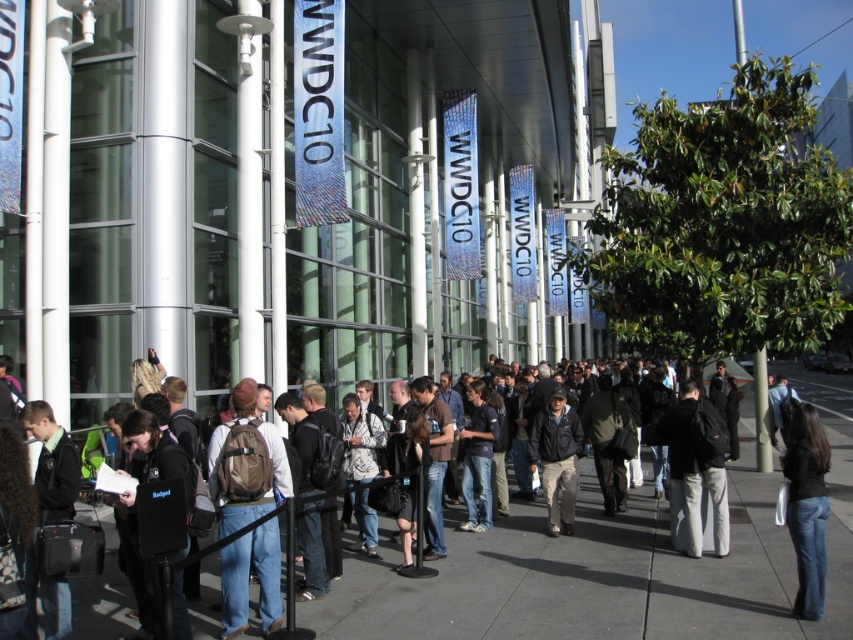
Question: Among these points, which one is farthest from the camera?

Choices:
 (A) (697, 406)
 (B) (241, 572)
 (C) (805, 496)
 (D) (567, 531)

Answer: (D)

Question: From the image, what is the correct spatial relationship of brown backpack at center in relation to denim jeans at lower right?

Choices:
 (A) right
 (B) left

Answer: (B)

Question: Which point is closer to the camera?

Choices:
 (A) dark gray jacket at center
 (B) dark gray backpack at center
 (C) brown backpack at center

Answer: (C)

Question: Does denim jeans at lower right appear on the left side of dark gray jacket at center?

Choices:
 (A) no
 (B) yes

Answer: (A)

Question: Does dark gray backpack at center appear on the left side of dark gray jacket at center?

Choices:
 (A) yes
 (B) no

Answer: (B)

Question: Which point is farther to the camera?

Choices:
 (A) (805, 525)
 (B) (254, 509)

Answer: (A)